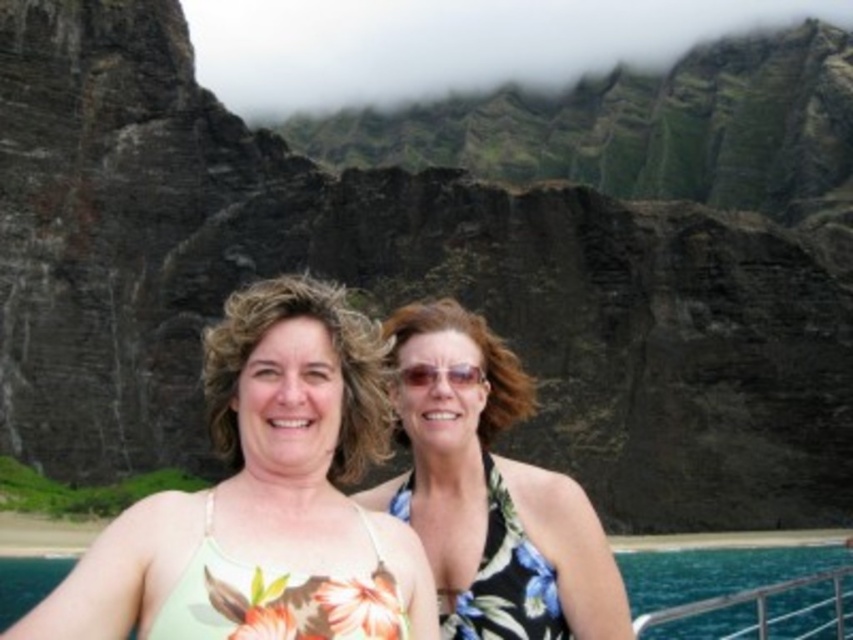
Can you confirm if floral print bikini top at center is thinner than green floral swimsuit at lower center?

Indeed, floral print bikini top at center has a lesser width compared to green floral swimsuit at lower center.

Identify the location of floral print bikini top at center. This screenshot has width=853, height=640. (489, 492).

Between point (495, 548) and point (792, 604), which one is positioned in front?

Point (495, 548)

Locate an element on the screen. This screenshot has height=640, width=853. floral print bikini top at center is located at coordinates (489, 492).

Describe the element at coordinates (264, 497) in the screenshot. I see `green floral swimsuit at center` at that location.

Where is `green floral swimsuit at center`? This screenshot has height=640, width=853. green floral swimsuit at center is located at coordinates (264, 497).

The image size is (853, 640). What are the coordinates of `green floral swimsuit at center` in the screenshot? It's located at (264, 497).

Which is more to the left, green floral swimsuit at center or floral print bikini top at center?

green floral swimsuit at center is more to the left.

What do you see at coordinates (264, 497) in the screenshot? The height and width of the screenshot is (640, 853). I see `green floral swimsuit at center` at bounding box center [264, 497].

This screenshot has height=640, width=853. I want to click on green floral swimsuit at center, so click(x=264, y=497).

Identify the location of green floral swimsuit at center. This screenshot has height=640, width=853. (264, 497).